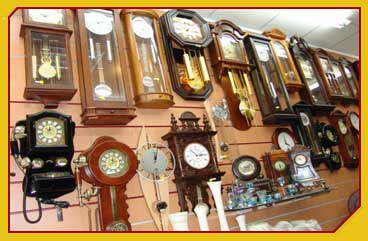
Where is `copper telephone`? The height and width of the screenshot is (241, 368). copper telephone is located at coordinates (78, 174).